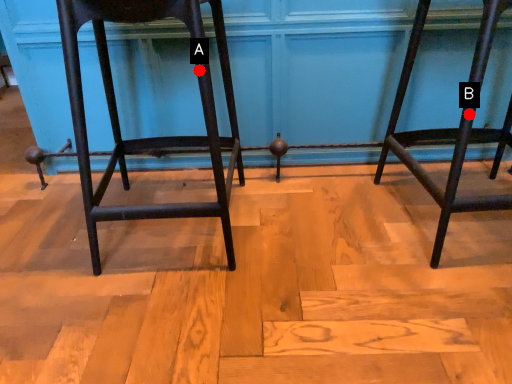
Question: Two points are circled on the image, labeled by A and B beside each circle. Which point is further to the camera?

Choices:
 (A) A is further
 (B) B is further

Answer: (B)